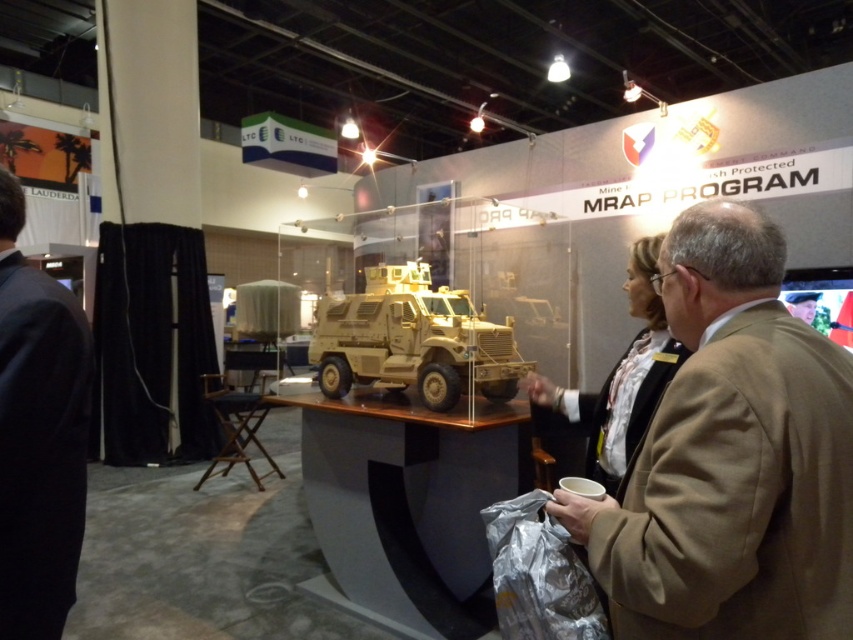
Question: Which of the following is the farthest from the observer?

Choices:
 (A) (483, 342)
 (B) (22, 609)

Answer: (A)

Question: From the image, what is the correct spatial relationship of tan fabric suit at right in relation to black suit at left?

Choices:
 (A) above
 (B) below

Answer: (B)

Question: Can you confirm if tan fabric suit at right is positioned to the right of tan matte mrap at center?

Choices:
 (A) yes
 (B) no

Answer: (A)

Question: From the image, what is the correct spatial relationship of tan fabric suit at right in relation to tan matte mrap at center?

Choices:
 (A) below
 (B) above

Answer: (A)

Question: Estimate the real-world distances between objects in this image. Which object is farther from the tan fabric suit at right?

Choices:
 (A) tan matte mrap at center
 (B) black suit at left

Answer: (A)

Question: Based on their relative distances, which object is farther from the tan matte mrap at center?

Choices:
 (A) tan fabric suit at right
 (B) black suit at left

Answer: (A)